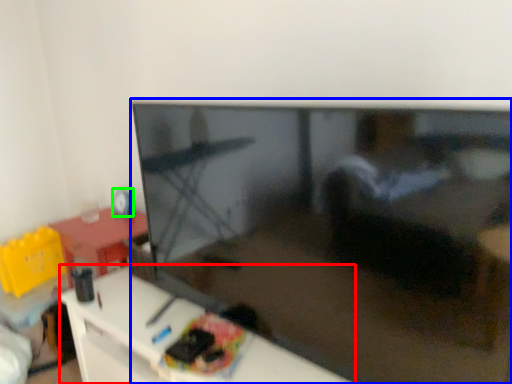
Question: Based on their relative distances, which object is farther from furniture (highlighted by a red box)? Choose from television (highlighted by a blue box) and toy (highlighted by a green box).

Choices:
 (A) television
 (B) toy

Answer: (B)